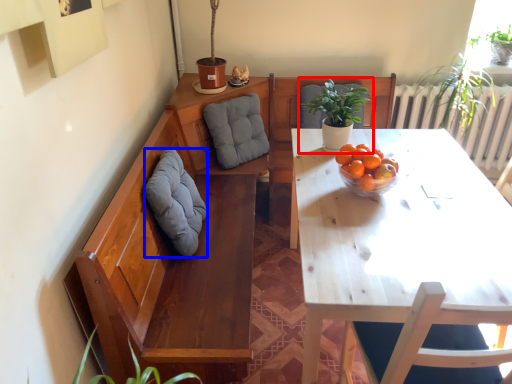
Question: Which point is closer to the camera, houseplant (highlighted by a red box) or gray (highlighted by a blue box)?

Choices:
 (A) houseplant
 (B) gray

Answer: (B)